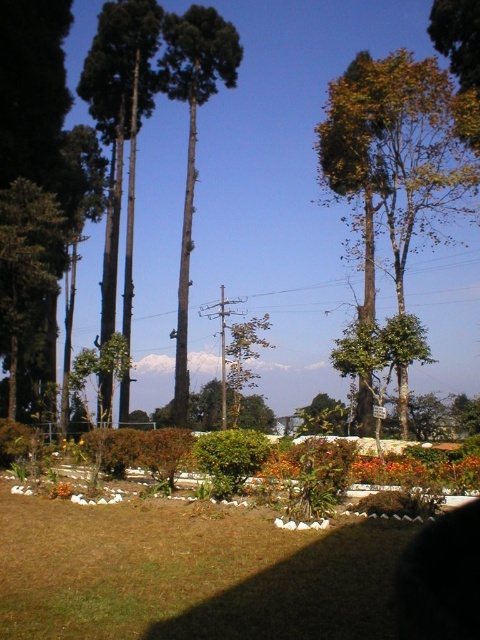
You are planning to place a garden bench between the green matte tree at center and the green matte tree at left. Considering their sizes, which tree will provide more shade for the bench?

The green matte tree at center is larger in size than the green matte tree at left, so it will provide more shade for the bench.

You are standing in the middle of the grassy area and want to take a photo of the green matte tree at center and the green matte tree at left. Which tree will appear closer to the camera in the photo?

The green matte tree at center will appear closer to the camera because it is positioned in front of the green matte tree at left.

You are designing a garden layout and need to place a new bench between the green matte tree at center and the orange matte flower at lower left. If the bench requires 2 meters of space between the two objects to fit, will there be enough space?

The green matte tree at center might be wider than orange matte flower at lower left, but the description does not provide specific measurements about their widths or the distance between them. Therefore, it is unclear if the 2 meters of space required for the bench is available.